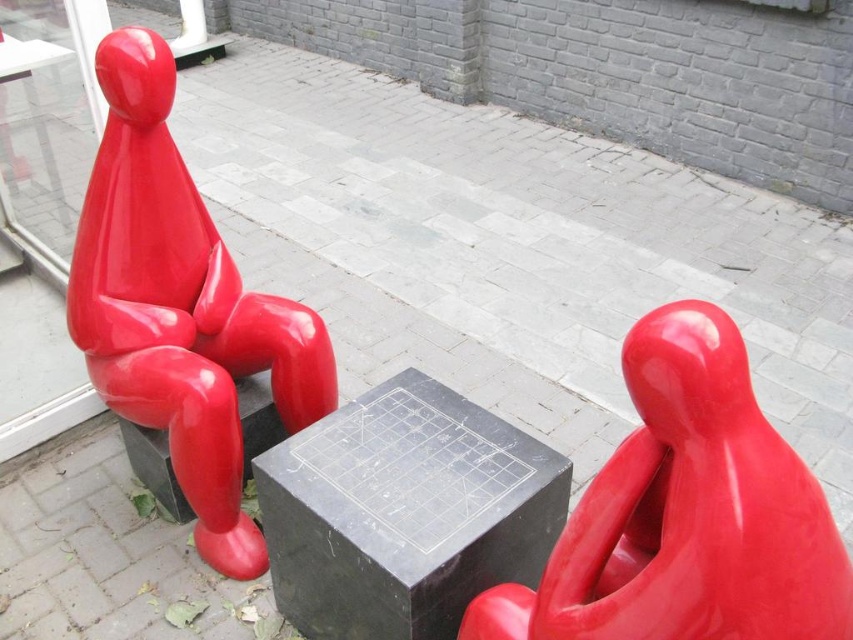
Which of these two, glossy red figure at right or glossy red figure at left, stands shorter?

With less height is glossy red figure at right.

Does glossy red figure at right have a lesser width compared to glossy red figure at left?

Indeed, glossy red figure at right has a lesser width compared to glossy red figure at left.

Which is behind, point (664, 384) or point (103, 92)?

Point (103, 92)

What are the coordinates of `glossy red figure at right` in the screenshot? It's located at (686, 513).